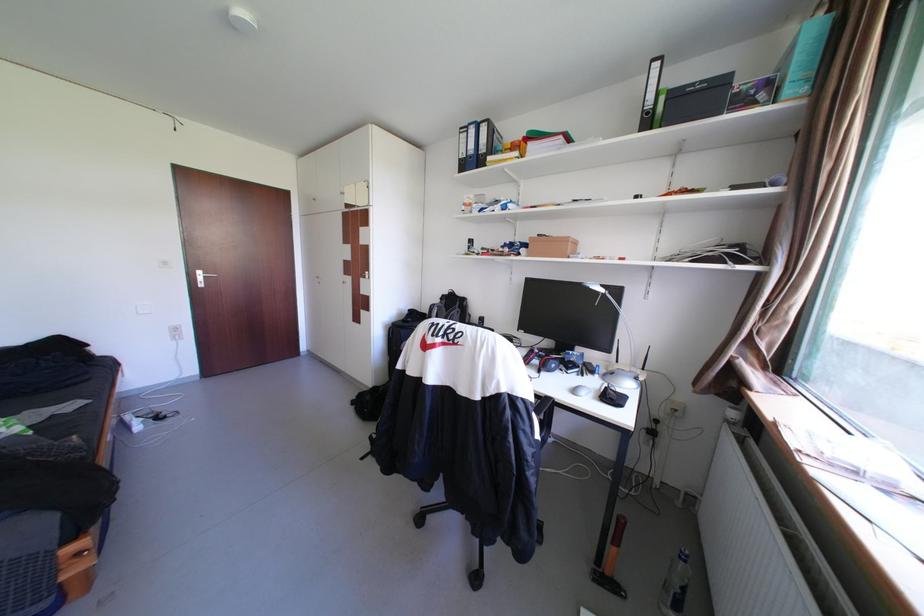
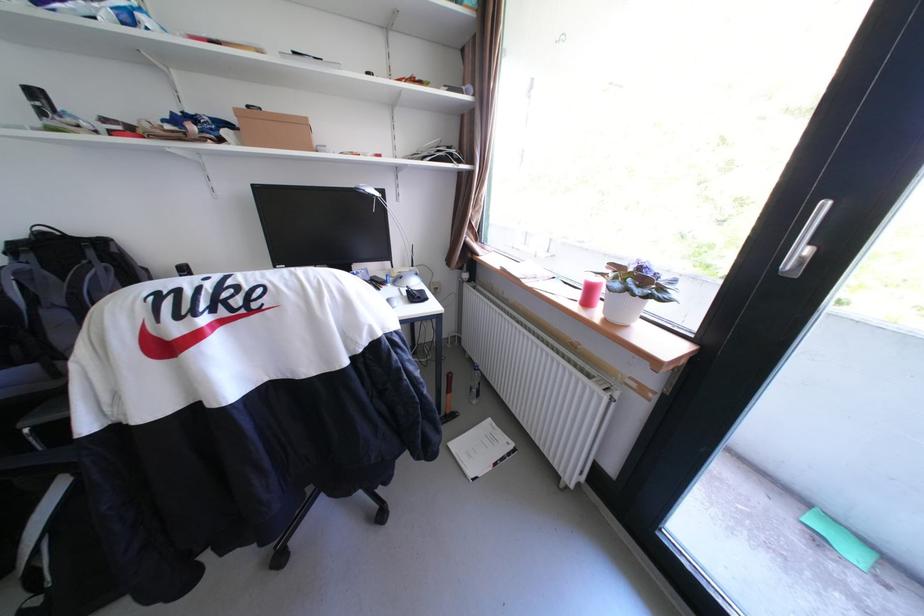
Locate, in the second image, the point that corresponds to pixel 609 293 in the first image.

(382, 198)